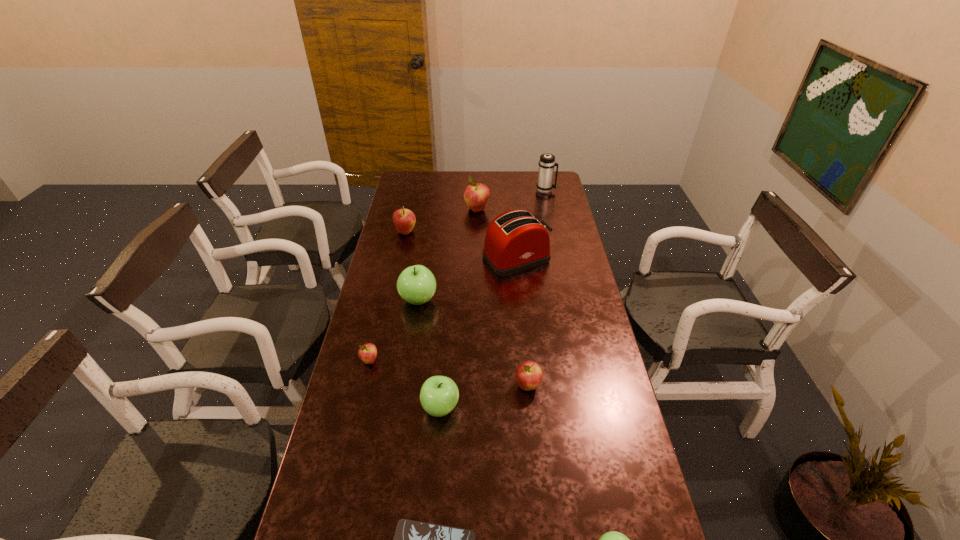
Find the location of a particular element. The height and width of the screenshot is (540, 960). free space that satisfies the following two spatial constraints: 1. on the back side of the ninth nearest object; 2. on the left side of the biggest green apple is located at coordinates click(432, 210).